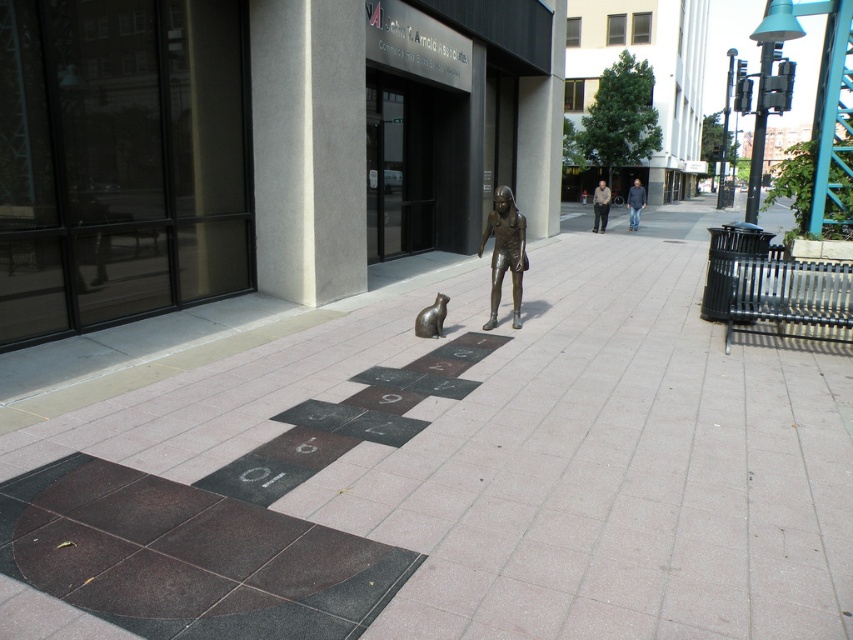
Which is behind, point (488, 232) or point (440, 333)?

The point (488, 232) is more distant.

Can you confirm if bronze statue at center is taller than bronze cat at center?

Yes, bronze statue at center is taller than bronze cat at center.

Locate an element on the screen. This screenshot has width=853, height=640. bronze statue at center is located at coordinates (505, 252).

Who is positioned more to the right, smooth concrete pavement at center or bronze statue at center?

Positioned to the right is smooth concrete pavement at center.

Is point (16, 467) positioned in front of point (508, 252)?

That is True.

Does point (236, 420) come in front of point (503, 189)?

That is True.

At what (x,y) coordinates should I click in order to perform the action: click on smooth concrete pavement at center. Please return your answer as a coordinate pair (x, y). Image resolution: width=853 pixels, height=640 pixels. Looking at the image, I should click on (436, 464).

Is point (640, 336) more distant than point (427, 332)?

Yes, point (640, 336) is behind point (427, 332).

Does smooth concrete pavement at center appear on the left side of bronze cat at center?

Incorrect, smooth concrete pavement at center is not on the left side of bronze cat at center.

Is point (506, 282) behind point (415, 330)?

Yes, point (506, 282) is behind point (415, 330).

The width and height of the screenshot is (853, 640). Find the location of `smooth concrete pavement at center`. smooth concrete pavement at center is located at coordinates (436, 464).